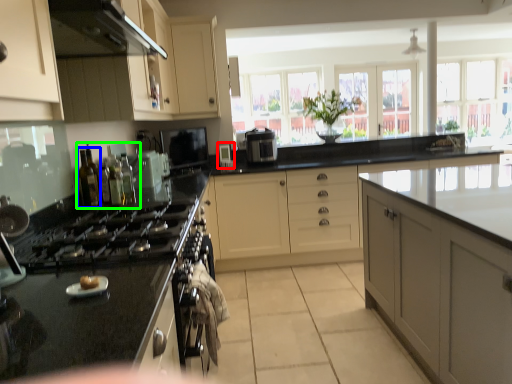
Question: Based on their relative distances, which object is nearer to appliance (highlighted by a red box)? Choose from bottle (highlighted by a blue box) and bottle (highlighted by a green box).

Choices:
 (A) bottle
 (B) bottle

Answer: (B)